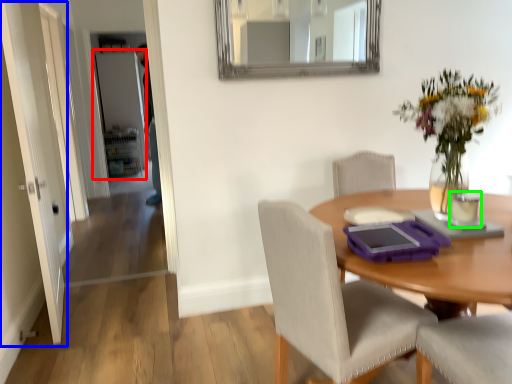
Question: Which is farther away from door (highlighted by a red box)? door (highlighted by a blue box) or coffee cup (highlighted by a green box)?

Choices:
 (A) door
 (B) coffee cup

Answer: (B)